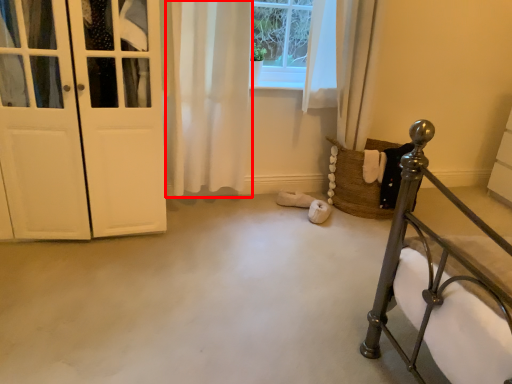
Question: From the image's perspective, what is the correct spatial relationship of curtain (annotated by the red box) in relation to door?

Choices:
 (A) above
 (B) below

Answer: (A)